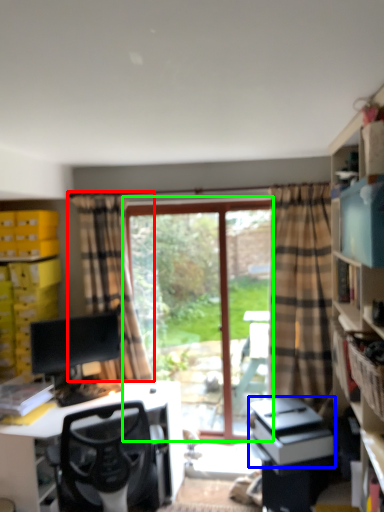
Question: Based on their relative distances, which object is farther from curtain (highlighted by a red box)? Choose from printer (highlighted by a blue box) and window (highlighted by a green box).

Choices:
 (A) printer
 (B) window

Answer: (A)